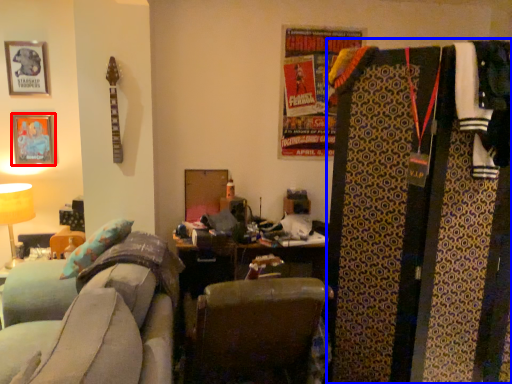
Question: Among these objects, which one is nearest to the camera, picture frame (highlighted by a red box) or dresser (highlighted by a blue box)?

Choices:
 (A) picture frame
 (B) dresser

Answer: (B)